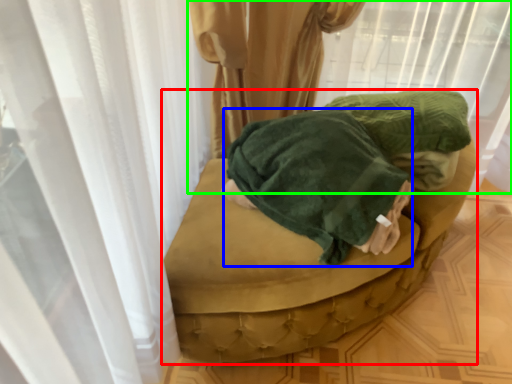
Question: Which is nearer to the furniture (highlighted by a red box)? clothing (highlighted by a blue box) or curtain (highlighted by a green box).

Choices:
 (A) clothing
 (B) curtain

Answer: (A)